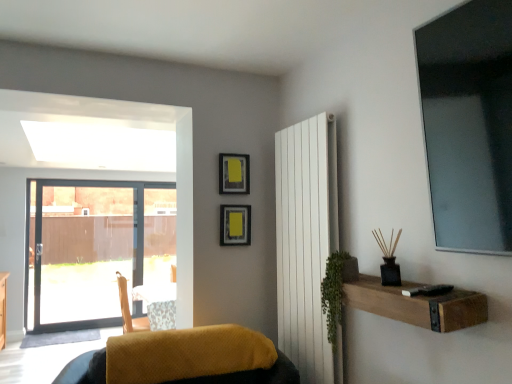
Question: Considering the positions of white smooth radiator at center-right and green leafy plant at right in the image, is white smooth radiator at center-right taller or shorter than green leafy plant at right?

Choices:
 (A) short
 (B) tall

Answer: (B)

Question: Would you say white smooth radiator at center-right is to the left or to the right of green leafy plant at right in the picture?

Choices:
 (A) right
 (B) left

Answer: (B)

Question: Estimate the real-world distances between objects in this image. Which object is farther from the brown wooden shelf at lower right?

Choices:
 (A) green leafy plant at right
 (B) velvet yellow cushion at lower center
 (C) white smooth radiator at center-right

Answer: (B)

Question: Based on their relative distances, which object is farther from the green leafy plant at right?

Choices:
 (A) brown wooden shelf at lower right
 (B) white smooth radiator at center-right
 (C) velvet yellow cushion at lower center

Answer: (C)